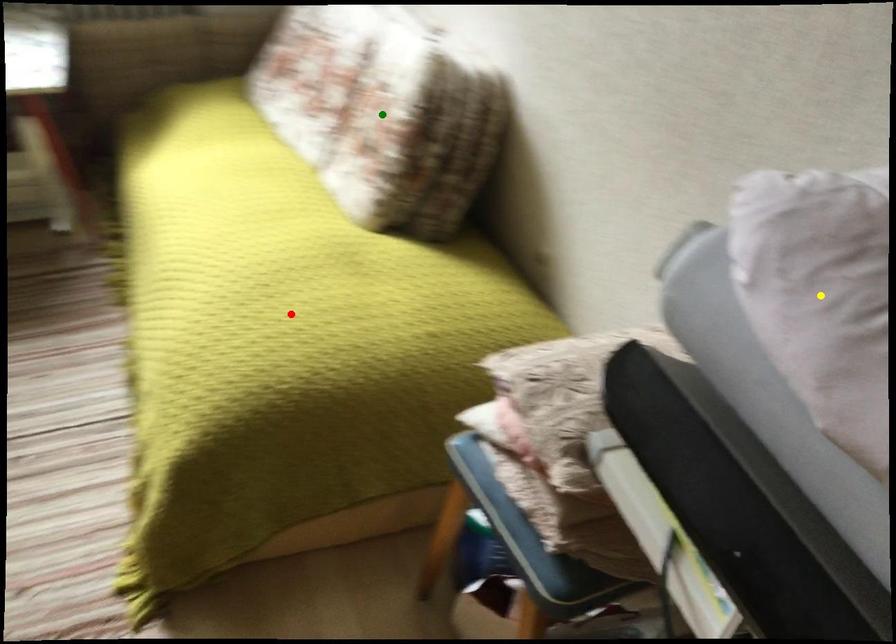
Looking at this image, order these from farthest to nearest:
green point | red point | yellow point

green point, red point, yellow point